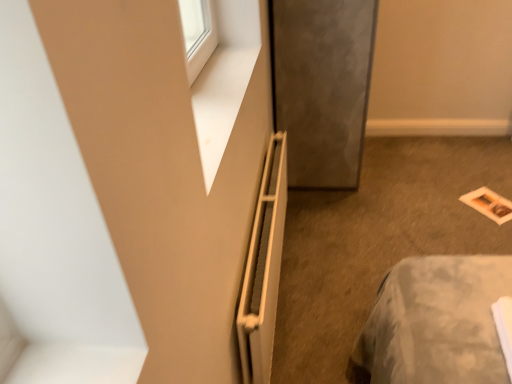
Measure the distance between point (316, 150) and camera.

The distance of point (316, 150) from camera is 2.62 meters.

What do you see at coordinates (322, 87) in the screenshot?
I see `matte gray screen door at center` at bounding box center [322, 87].

The width and height of the screenshot is (512, 384). Describe the element at coordinates (489, 204) in the screenshot. I see `matte paper magazine at lower right` at that location.

Where is `white matte radiator at center`? This screenshot has height=384, width=512. white matte radiator at center is located at coordinates (263, 268).

Is matte paper magazine at lower right in front of or behind white matte radiator at center in the image?

Visually, matte paper magazine at lower right is located behind white matte radiator at center.

Is matte paper magazine at lower right next to white matte radiator at center and touching it?

No, matte paper magazine at lower right is not with white matte radiator at center.

Between matte paper magazine at lower right and white matte radiator at center, which one appears on the right side from the viewer's perspective?

From the viewer's perspective, matte paper magazine at lower right appears more on the right side.

Image resolution: width=512 pixels, height=384 pixels. I want to click on radiator that is above the matte paper magazine at lower right (from a real-world perspective), so click(263, 268).

Considering the sizes of matte gray screen door at center and white matte radiator at center in the image, is matte gray screen door at center wider or thinner than white matte radiator at center?

In the image, matte gray screen door at center appears to be wider than white matte radiator at center.

Does point (308, 175) come farther from viewer compared to point (260, 209)?

Yes, point (308, 175) is behind point (260, 209).

Looking at this image, measure the distance from matte gray screen door at center to white matte radiator at center.

They are 67.35 centimeters apart.

From a real-world perspective, which is physically above, matte gray screen door at center or white matte radiator at center?

In real-world perspective, matte gray screen door at center is above.

From a real-world perspective, relative to matte gray screen door at center, is matte paper magazine at lower right vertically above or below?

Clearly, from a real-world perspective, matte paper magazine at lower right is below matte gray screen door at center.

Considering the relative sizes of matte paper magazine at lower right and matte gray screen door at center in the image provided, is matte paper magazine at lower right bigger than matte gray screen door at center?

Actually, matte paper magazine at lower right might be smaller than matte gray screen door at center.

Considering the sizes of matte paper magazine at lower right and matte gray screen door at center in the image, is matte paper magazine at lower right wider or thinner than matte gray screen door at center?

In the image, matte paper magazine at lower right appears to be more narrow than matte gray screen door at center.

Considering the relative sizes of matte gray screen door at center and matte paper magazine at lower right in the image provided, is matte gray screen door at center shorter than matte paper magazine at lower right?

No.

From the image's perspective, would you say matte gray screen door at center is shown under matte paper magazine at lower right?

No, from the image's perspective, matte gray screen door at center is not beneath matte paper magazine at lower right.

Measure the distance between matte gray screen door at center and matte paper magazine at lower right.

1.04 meters.

From the image's perspective, is white matte radiator at center located above matte gray screen door at center?

No.

Is white matte radiator at center aimed at matte gray screen door at center?

No, white matte radiator at center does not turn towards matte gray screen door at center.

The height and width of the screenshot is (384, 512). I want to click on radiator below the matte gray screen door at center (from the image's perspective), so click(x=263, y=268).

Considering the relative sizes of white matte radiator at center and matte gray screen door at center in the image provided, is white matte radiator at center wider than matte gray screen door at center?

Incorrect, the width of white matte radiator at center does not surpass that of matte gray screen door at center.

From a real-world perspective, who is located higher, white matte radiator at center or matte paper magazine at lower right?

white matte radiator at center is physically above.

Are white matte radiator at center and matte paper magazine at lower right making contact?

There is a gap between white matte radiator at center and matte paper magazine at lower right.

Which of these two, white matte radiator at center or matte paper magazine at lower right, is bigger?

white matte radiator at center.

This screenshot has width=512, height=384. In the image, there is a white matte radiator at center. In order to click on magazine above it (from the image's perspective) in this screenshot , I will do `click(489, 204)`.

Image resolution: width=512 pixels, height=384 pixels. I want to click on radiator that is on the left side of matte gray screen door at center, so pyautogui.click(x=263, y=268).

From the image, which object appears to be farther from matte paper magazine at lower right, matte gray screen door at center or white matte radiator at center?

white matte radiator at center is further to matte paper magazine at lower right.

Based on their spatial positions, is white matte radiator at center or matte paper magazine at lower right further from matte gray screen door at center?

matte paper magazine at lower right is further to matte gray screen door at center.

Estimate the real-world distances between objects in this image. Which object is closer to white matte radiator at center, matte paper magazine at lower right or matte gray screen door at center?

matte gray screen door at center is positioned closer to the anchor white matte radiator at center.

Based on their spatial positions, is white matte radiator at center or matte gray screen door at center closer to matte paper magazine at lower right?

matte gray screen door at center is closer to matte paper magazine at lower right.

Looking at the image, which one is located closer to white matte radiator at center, matte gray screen door at center or matte paper magazine at lower right?

Among the two, matte gray screen door at center is located nearer to white matte radiator at center.

Looking at the image, which one is located closer to matte gray screen door at center, matte paper magazine at lower right or white matte radiator at center?

Based on the image, white matte radiator at center appears to be nearer to matte gray screen door at center.

This screenshot has width=512, height=384. Identify the location of screen door located between white matte radiator at center and matte paper magazine at lower right in the left-right direction. (322, 87).